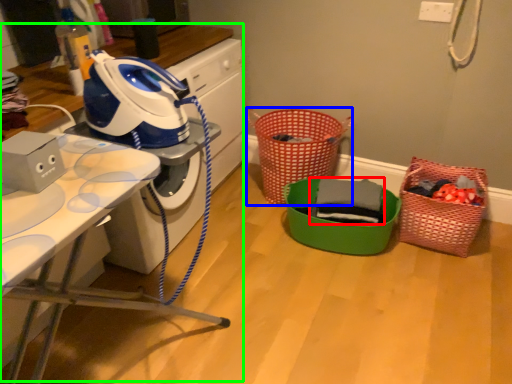
Question: Considering the real-world distances, which object is farthest from clothing (highlighted by a red box)? basket (highlighted by a blue box) or computer desk (highlighted by a green box)?

Choices:
 (A) basket
 (B) computer desk

Answer: (B)